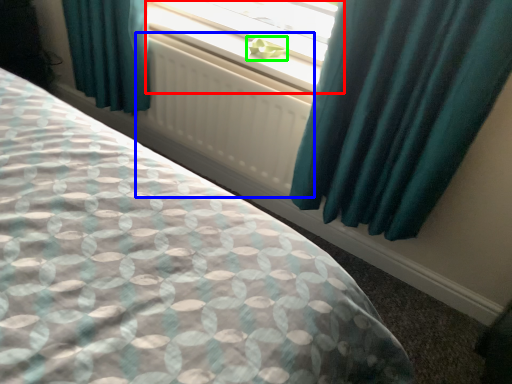
Question: Estimate the real-world distances between objects in this image. Which object is closer to window (highlighted by a red box), radiator (highlighted by a blue box) or plant (highlighted by a green box)?

Choices:
 (A) radiator
 (B) plant

Answer: (B)